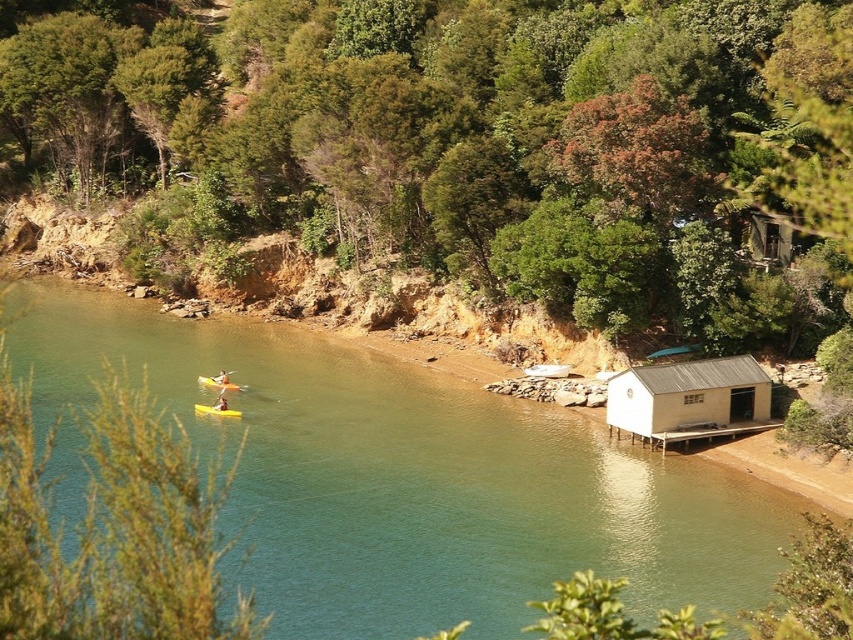
You are standing at the center of the image and want to find the white matte hut at lower right. According to the coordinates, where should you look relative to your current position?

The white matte hut at lower right is located at coordinates point (689, 400), which is to the lower right of your current position.

You are standing on the beach looking out at the water. Which object is closer to you between the green smooth water at center and the yellow foam at center?

The green smooth water at center is closer to you than the yellow foam at center according to the description.